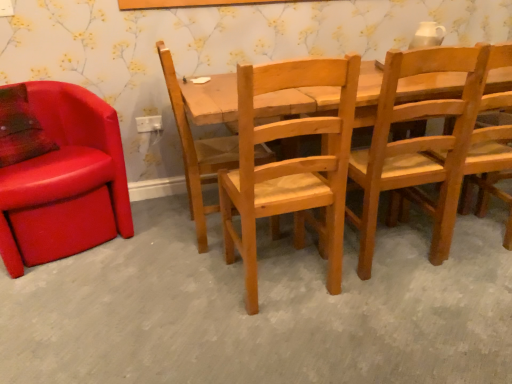
Question: Is natural wood chair at center, placed as the third chair when sorted from left to right, wider or thinner than wooden chair at center, positioned as the fourth chair in left-to-right order?

Choices:
 (A) thin
 (B) wide

Answer: (A)

Question: Considering their positions, is natural wood chair at center, placed as the third chair when sorted from left to right, located in front of or behind wooden chair at center, which is counted as the second chair, starting from the right?

Choices:
 (A) front
 (B) behind

Answer: (A)

Question: Estimate the real-world distances between objects in this image. Which object is closer to the light brown wood chair at right, arranged as the fifth chair when viewed from the left?

Choices:
 (A) leather at left, which is the fifth chair in right-to-left order
 (B) white plastic power outlet at center
 (C) natural wood chair at center, which is the third chair in right-to-left order
 (D) natural wood chair at center, which appears as the fourth chair when viewed from the right
 (E) wooden chair at center, which is counted as the second chair, starting from the right

Answer: (E)

Question: Estimate the real-world distances between objects in this image. Which object is closer to the white plastic power outlet at center?

Choices:
 (A) light brown wood chair at right, which appears as the 1th chair when viewed from the right
 (B) wooden chair at center, which is counted as the second chair, starting from the right
 (C) natural wood chair at center, which is the third chair in right-to-left order
 (D) leather at left, which is the fifth chair in right-to-left order
 (E) natural wood chair at center, the 2th chair viewed from the left

Answer: (D)